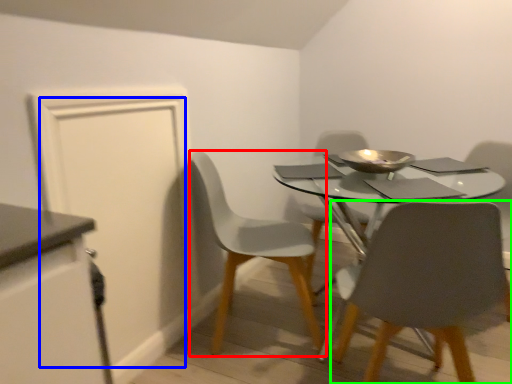
Question: Which object is positioned farthest from chair (highlighted by a red box)? Select from door (highlighted by a blue box) and chair (highlighted by a green box).

Choices:
 (A) door
 (B) chair

Answer: (B)